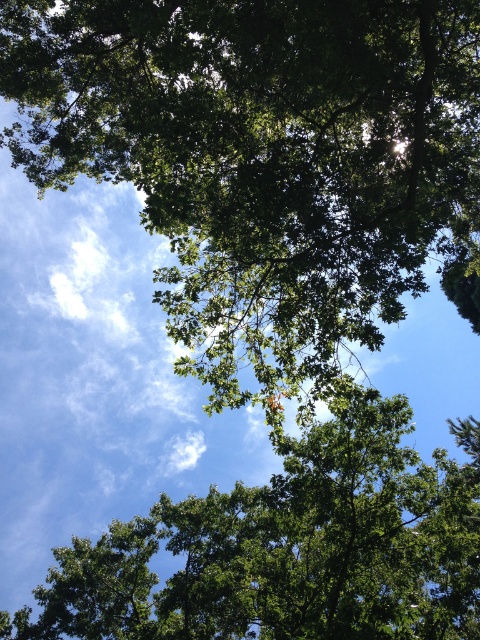
You are standing under a tree and looking up at the green leafy tree at upper center. If you want to measure how far you are from the base of the tree, would the distance be more or less than 10 meters?

The distance between you and the green leafy tree at upper center is 9.59 meters, which is less than 10 meters.

You are standing under two green leafy trees. One is the green leafy tree at upper center and the other is the green leafy tree at center. Which tree is located to the left of the other?

The green leafy tree at upper center is positioned on the left side of green leafy tree at center.

You are standing under a tree and looking up at the green leafy tree at upper center. There is a point marked at coordinates point (262, 160). Where would this point be located on the green leafy tree at upper center?

The point (262, 160) is located on the green leafy tree at upper center.